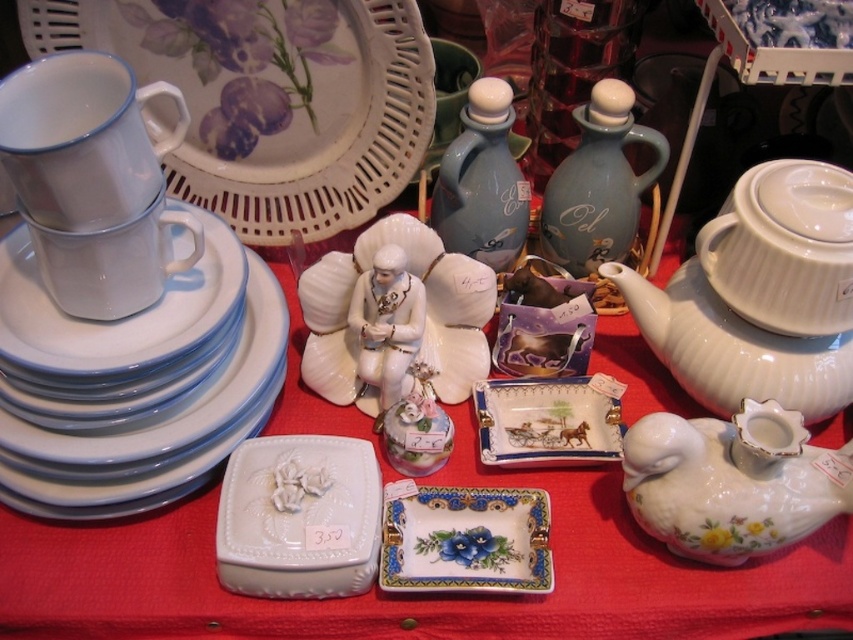
Between white glossy teapot at center and porcelain tray at center, which one has more height?

white glossy teapot at center is taller.

Can you confirm if white glossy teapot at center is taller than porcelain tray at center?

Yes, white glossy teapot at center is taller than porcelain tray at center.

The image size is (853, 640). Describe the element at coordinates (418, 595) in the screenshot. I see `white glossy teapot at center` at that location.

At what (x,y) coordinates should I click in order to perform the action: click on white glossy teapot at center. Please return your answer as a coordinate pair (x, y). Looking at the image, I should click on (418, 595).

Does white glossy platter at upper left have a greater height compared to decorative ceramic platter at center?

Correct, white glossy platter at upper left is much taller as decorative ceramic platter at center.

Is the position of white glossy platter at upper left less distant than that of decorative ceramic platter at center?

Yes.

Does point (78, 483) come farther from viewer compared to point (581, 385)?

No, (78, 483) is closer to viewer.

Locate an element on the screen. This screenshot has width=853, height=640. white glossy platter at upper left is located at coordinates (134, 381).

Can you confirm if white glossy teapot at center is positioned to the left of matte blue ceramic teapot at center?

Yes, white glossy teapot at center is to the left of matte blue ceramic teapot at center.

Does white glossy teapot at center have a larger size compared to matte blue ceramic teapot at center?

Correct, white glossy teapot at center is larger in size than matte blue ceramic teapot at center.

Measure the distance between point (561, 561) and camera.

Point (561, 561) and camera are 33.68 inches apart from each other.

Locate an element on the screen. white glossy teapot at center is located at coordinates (418, 595).